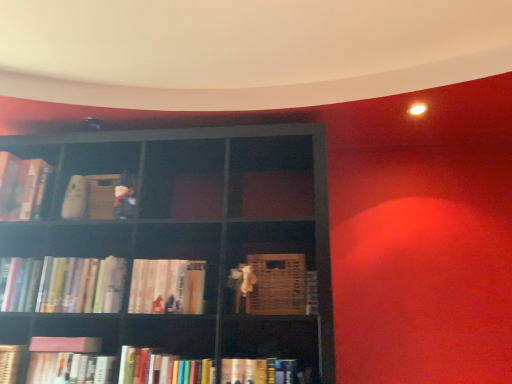
Question: Considering the positions of hardcover books at left, the fifth book viewed from the right, and hardcover books at center, the 4th book positioned from the right, in the image, is hardcover books at left, the fifth book viewed from the right, taller or shorter than hardcover books at center, the 4th book positioned from the right,?

Choices:
 (A) short
 (B) tall

Answer: (B)

Question: From a real-world perspective, is hardcover books at left, the fifth book viewed from the right, physically located above or below hardcover books at center, the 7th book from the left?

Choices:
 (A) below
 (B) above

Answer: (B)

Question: Considering the real-world distances, which object is closest to the hardcover book at lower left, placed as the ninth book when sorted from right to left?

Choices:
 (A) hardcover books at lower center, positioned as the 8th book in left-to-right order
 (B) hardcover book at lower left, which is the 5th book from left to right
 (C) pink matte book at lower left, the fourth book positioned from the left
 (D) hardcover book at lower center, the ninth book in the left-to-right sequence
 (E) hardcover book at left, which is the 10th book in right-to-left order

Answer: (C)

Question: Which object is the closest to the hardcover books at lower center, positioned as the 8th book in left-to-right order?

Choices:
 (A) hardcover book at lower left, the second book viewed from the left
 (B) hardcover books at center, the 7th book from the left
 (C) hardcover book at lower left, acting as the 6th book starting from the right
 (D) hardcover book at left, which is the 10th book in right-to-left order
 (E) hardcover books at left, acting as the eighth book starting from the right

Answer: (C)